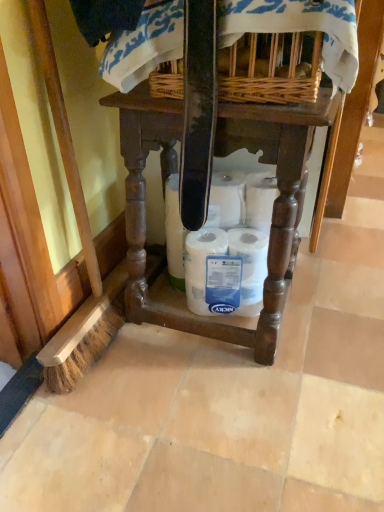
Question: From a real-world perspective, is wooden table at center located higher than woven wicker basket at upper center?

Choices:
 (A) no
 (B) yes

Answer: (A)

Question: Is wooden table at center turned away from woven wicker basket at upper center?

Choices:
 (A) yes
 (B) no

Answer: (B)

Question: From a real-world perspective, is wooden table at center positioned under woven wicker basket at upper center based on gravity?

Choices:
 (A) yes
 (B) no

Answer: (A)

Question: Does wooden table at center have a greater width compared to woven wicker basket at upper center?

Choices:
 (A) no
 (B) yes

Answer: (B)

Question: Considering the relative sizes of wooden table at center and woven wicker basket at upper center in the image provided, is wooden table at center taller than woven wicker basket at upper center?

Choices:
 (A) no
 (B) yes

Answer: (B)

Question: Is wooden table at center not inside woven wicker basket at upper center?

Choices:
 (A) yes
 (B) no

Answer: (A)

Question: Is woven wicker basket at upper center aimed at wooden table at center?

Choices:
 (A) no
 (B) yes

Answer: (A)

Question: Is woven wicker basket at upper center outside of wooden table at center?

Choices:
 (A) no
 (B) yes

Answer: (B)

Question: From the image's perspective, is woven wicker basket at upper center over wooden table at center?

Choices:
 (A) yes
 (B) no

Answer: (A)

Question: From a real-world perspective, is woven wicker basket at upper center located beneath wooden table at center?

Choices:
 (A) yes
 (B) no

Answer: (B)

Question: Does woven wicker basket at upper center have a larger size compared to wooden table at center?

Choices:
 (A) no
 (B) yes

Answer: (A)

Question: Does woven wicker basket at upper center have a greater height compared to wooden table at center?

Choices:
 (A) no
 (B) yes

Answer: (A)

Question: From the image's perspective, is wooden table at center located beneath white matte toilet paper at center?

Choices:
 (A) yes
 (B) no

Answer: (B)